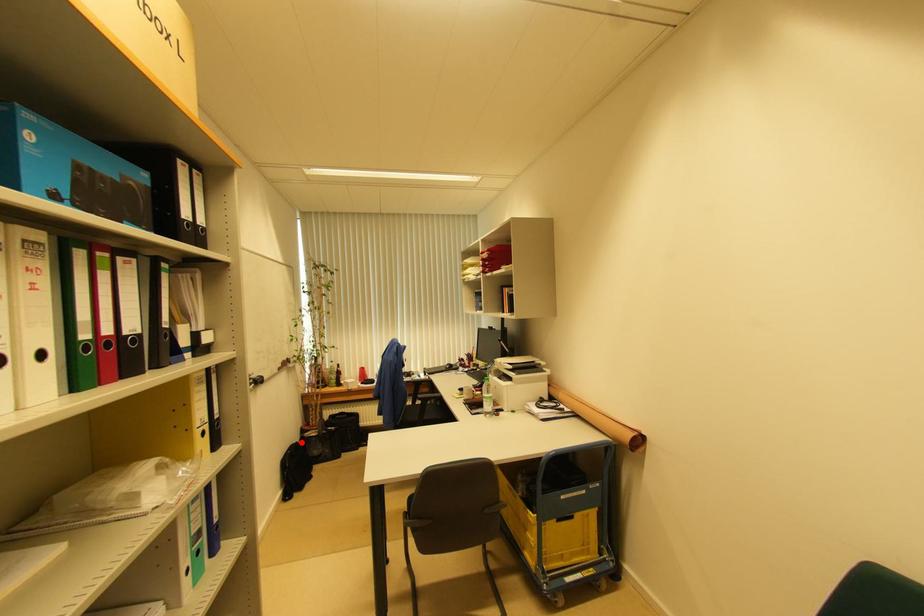
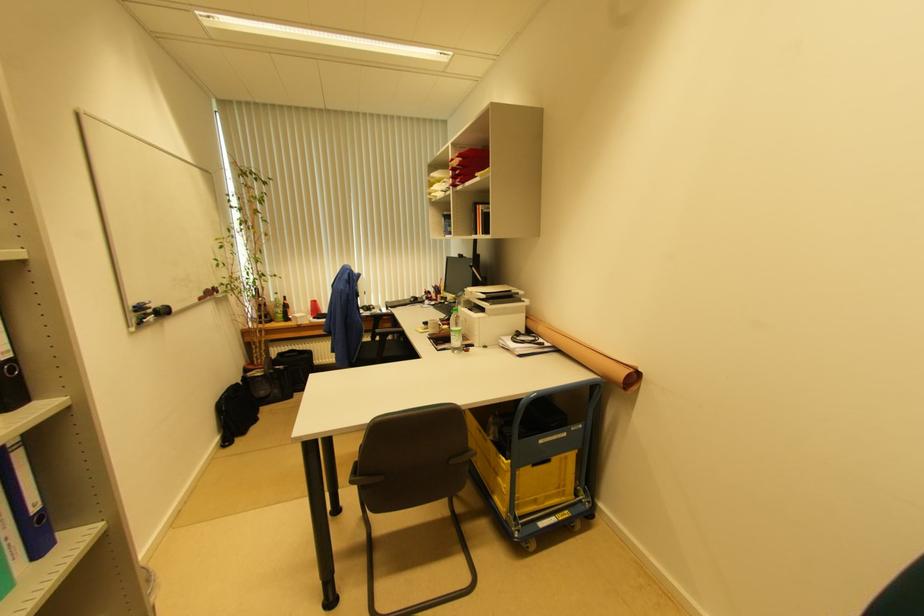
Question: I am providing you with two images of the same scene from different viewpoints. In image1, a red point is highlighted. Considering the same 3D point in image2, which of the following is correct?

Choices:
 (A) It is closer
 (B) It is farther

Answer: (A)